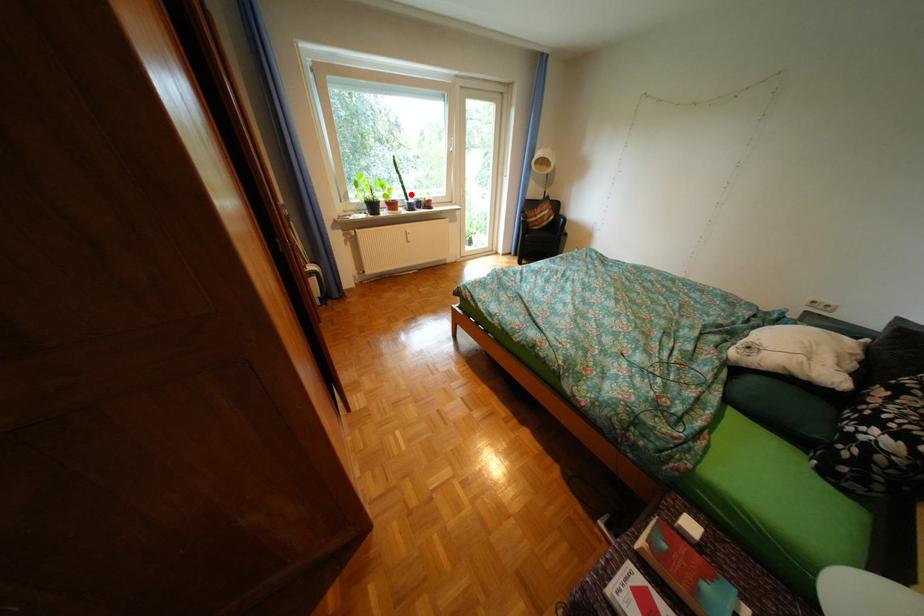
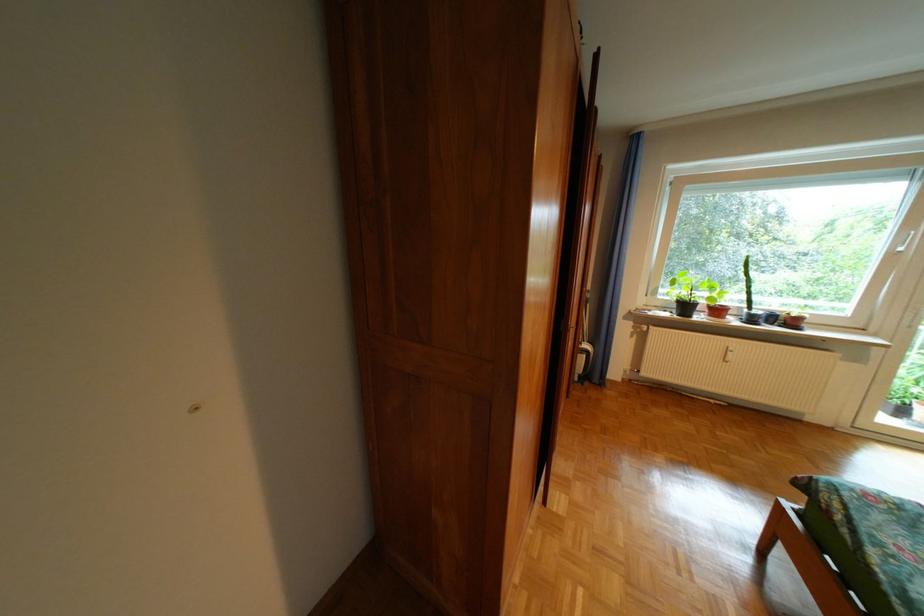
Question: I am providing you with two images of the same scene from different viewpoints. A red point is shown in image1. For the corresponding object point in image2, is it positioned nearer or farther from the camera?

Choices:
 (A) Nearer
 (B) Farther

Answer: (B)